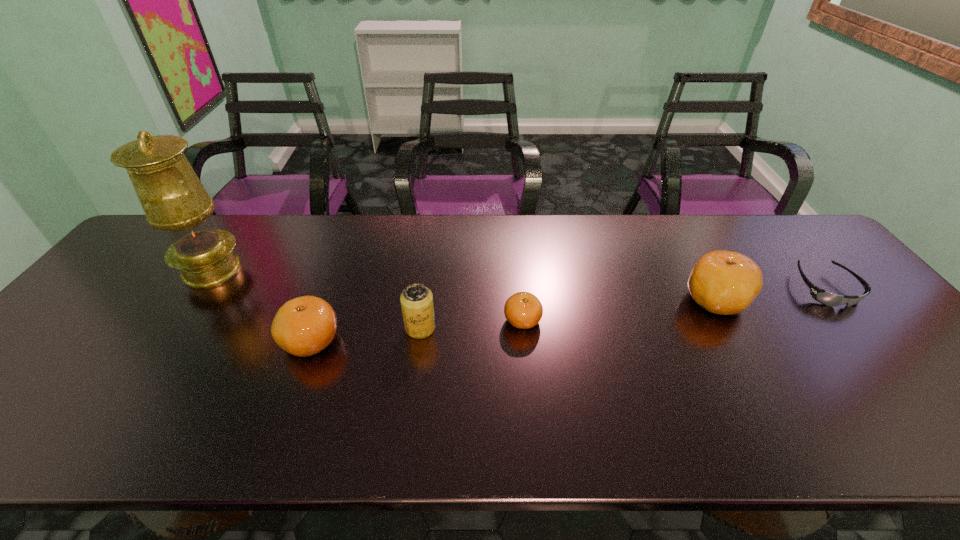
Locate an element on the screen. The image size is (960, 540). the second tallest clementine is located at coordinates (304, 326).

Identify the location of the leftmost clementine. The width and height of the screenshot is (960, 540). (304, 326).

Where is `the second shortest object`? The image size is (960, 540). the second shortest object is located at coordinates (523, 310).

Image resolution: width=960 pixels, height=540 pixels. I want to click on the third object from right to left, so click(x=523, y=310).

In order to click on the fifth object from left to right in this screenshot , I will do `click(723, 282)`.

At what (x,y) coordinates should I click in order to perform the action: click on the shortest object. Please return your answer as a coordinate pair (x, y). Image resolution: width=960 pixels, height=540 pixels. Looking at the image, I should click on (822, 296).

Find the location of a particular element. This screenshot has width=960, height=540. the rightmost object is located at coordinates (822, 296).

Where is `the fourth object from right to left`? This screenshot has height=540, width=960. the fourth object from right to left is located at coordinates (416, 300).

At what (x,y) coordinates should I click in order to perform the action: click on the leftmost object. Please return your answer as a coordinate pair (x, y). The height and width of the screenshot is (540, 960). Looking at the image, I should click on (174, 200).

The width and height of the screenshot is (960, 540). Find the location of `oil lamp`. oil lamp is located at coordinates (174, 200).